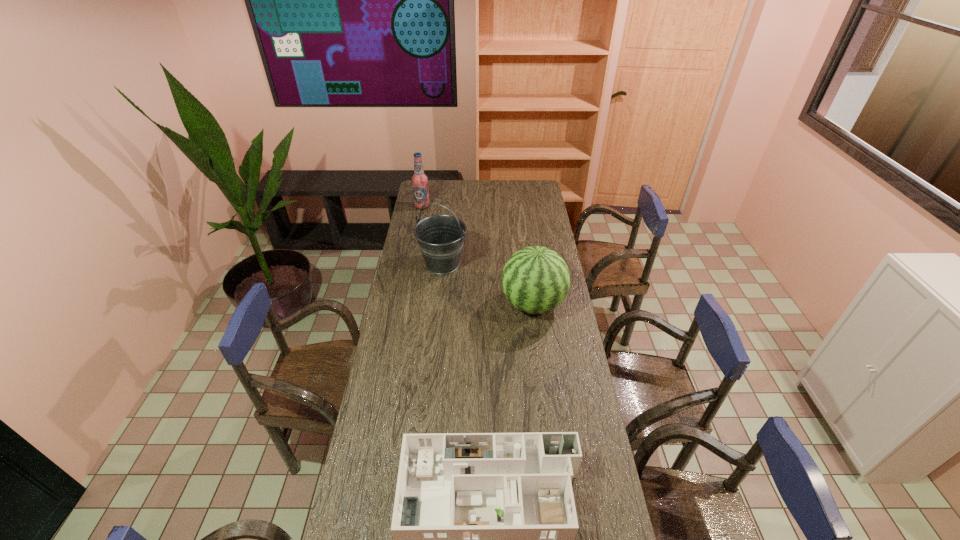
Identify the location of bucket. The image size is (960, 540). (440, 238).

At what (x,y) coordinates should I click in order to perform the action: click on the farthest object. Please return your answer as a coordinate pair (x, y). The height and width of the screenshot is (540, 960). Looking at the image, I should click on pyautogui.click(x=419, y=180).

In order to click on the second nearest object in this screenshot , I will do `click(535, 280)`.

Locate an element on the screen. free space located on the right of the bucket is located at coordinates (538, 264).

Image resolution: width=960 pixels, height=540 pixels. In order to click on free space located 0.360m on the front of the alcohol in this screenshot , I will do `click(415, 248)`.

This screenshot has width=960, height=540. In order to click on vacant point located 0.320m on the back of the second nearest object in this screenshot , I will do `click(525, 242)`.

Locate an element on the screen. The width and height of the screenshot is (960, 540). bucket that is at the left edge is located at coordinates (440, 238).

Identify the location of alcohol that is at the left edge. (419, 180).

What are the coordinates of `object that is positioned at the right edge` in the screenshot? It's located at (535, 280).

In order to click on free space at the far edge of the desktop in this screenshot , I will do `click(504, 188)`.